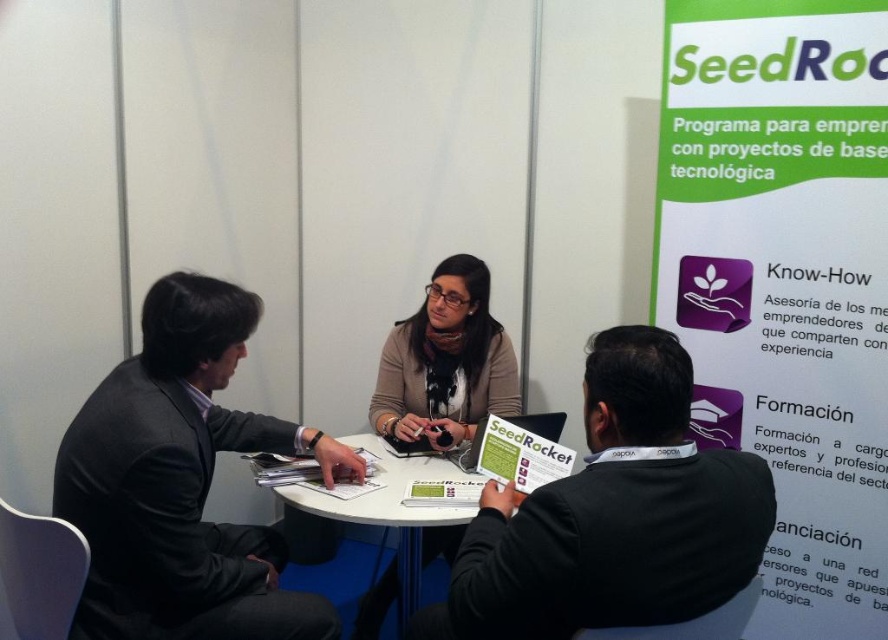
Who is lower down, black sweater at center or matte beige sweater at center?

Positioned lower is black sweater at center.

Based on the photo, can you confirm if black sweater at center is positioned to the right of matte beige sweater at center?

Correct, you'll find black sweater at center to the right of matte beige sweater at center.

Which is in front, point (538, 515) or point (458, 253)?

Point (538, 515) is more forward.

You are a GUI agent. You are given a task and a screenshot of the screen. Output one action in this format:
    pyautogui.click(x=<x>, y=<y>)
    Task: Click on the black sweater at center
    
    Given the screenshot: What is the action you would take?
    [x=614, y=515]

Which of these two, dark gray suit at left or white plastic table at center, stands taller?

With more height is dark gray suit at left.

I want to click on dark gray suit at left, so click(181, 483).

Does black sweater at center appear under white plastic table at center?

No.

Does black sweater at center have a greater height compared to white plastic table at center?

No, black sweater at center is not taller than white plastic table at center.

This screenshot has height=640, width=888. Identify the location of black sweater at center. (614, 515).